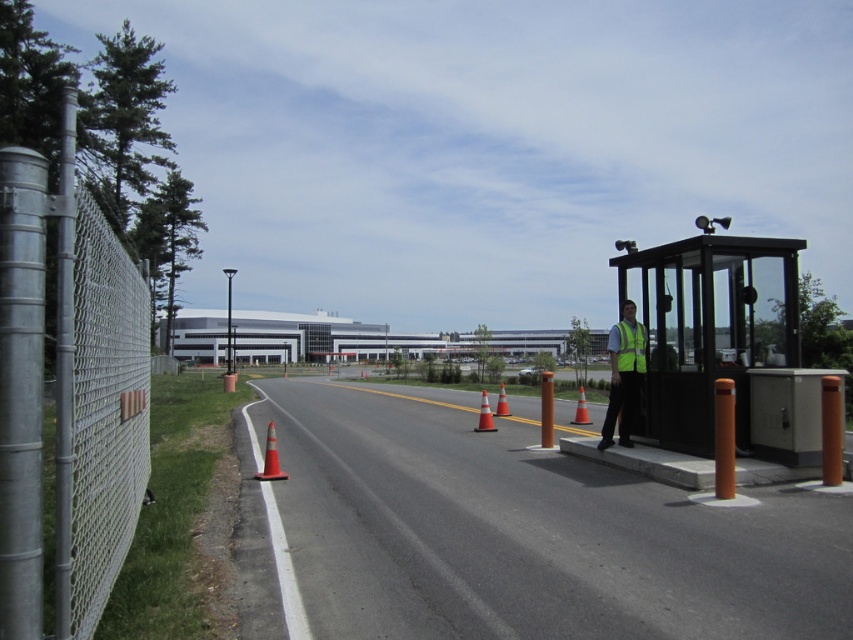
You are standing at the access point and need to determine the visibility of two points marked in the scene. According to the image, which point is closer to you, point (569, 584) or point (33, 467)?

Point (33, 467) is closer to you because the description states that point (569, 584) is further away from the viewer compared to point (33, 467).

You are driving a delivery truck that is 12 feet wide. You need to pass through the asphalt road at center. There is an orange reflective cone at center in your path. Can your truck safely navigate around the cone without hitting it?

The asphalt road at center has a larger size compared to orange reflective cone at center, so yes, the truck can safely navigate around the cone without hitting it since the road is wider than the cone.

You are a delivery driver approaching the access point. You need to park your vehicle at the point closer to the booth. Which point should you choose between point (740, 301) and point (502, 387)?

Point (740, 301) is in front of point (502, 387), so it is closer to the booth. Therefore, you should choose point (740, 301) to park your vehicle.